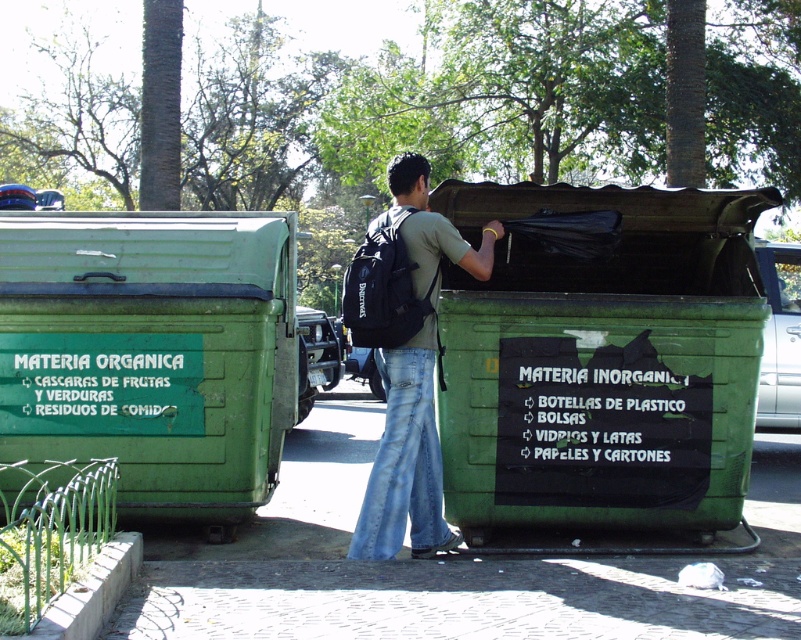
You are standing in front of two recycling bins. The green matte plastic at left and jeans at center. Which object is closer to you?

The green matte plastic at left is closer to you because it is further to the viewer than jeans at center.

You are standing at the point closest to the person interacting with the MATERIA INORGANICA bin. Which of the two points, point (731, 458) or point (75, 435), is closer to you?

Point (75, 435) is closer to you because it is less further to the viewer than point (731, 458).

You are standing at the point labeled as point [602,358] in the image. Which recycling bin are you facing? The options are the green matte plastic recycling bin at center, the MATERIA ORGANICA bin on the left, or the MATERIA INORGANICA bin on the right.

The point [602,358] corresponds to the green matte plastic recycling bin at center, so you are facing the green matte plastic recycling bin at center.